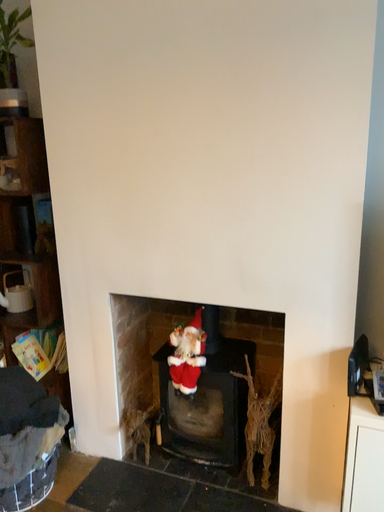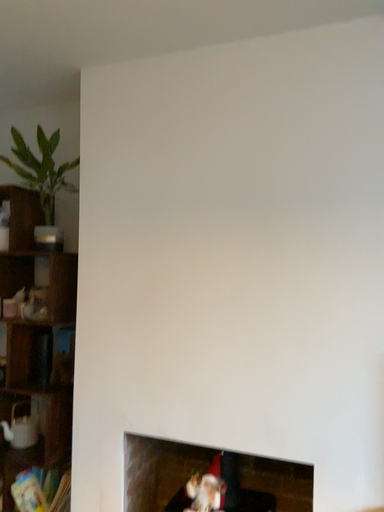
Question: Which way did the camera rotate in the video?

Choices:
 (A) rotated upward
 (B) rotated downward

Answer: (A)